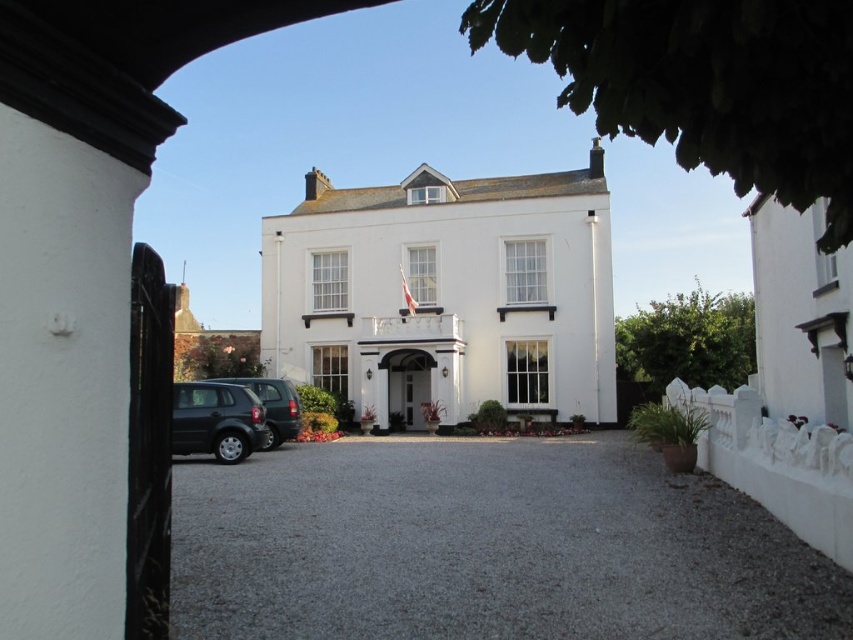
From the picture: Can you confirm if satin black car at lower left is positioned above matte dark green suv at lower left?

Actually, satin black car at lower left is below matte dark green suv at lower left.

Measure the distance between point (175,392) and camera.

Point (175,392) is 16.10 meters from camera.

At what (x,y) coordinates should I click in order to perform the action: click on satin black car at lower left. Please return your answer as a coordinate pair (x, y). Looking at the image, I should click on (216, 420).

How distant is gray gravel driveway at center from satin black car at lower left?

5.76 meters

Is gray gravel driveway at center shorter than satin black car at lower left?

Indeed, gray gravel driveway at center has a lesser height compared to satin black car at lower left.

Where is `gray gravel driveway at center`? The width and height of the screenshot is (853, 640). gray gravel driveway at center is located at coordinates (486, 547).

Is point (171, 611) farther from viewer compared to point (291, 385)?

That is False.

Which is below, gray gravel driveway at center or matte dark green suv at lower left?

gray gravel driveway at center is below.

Between point (613, 625) and point (221, 381), which one is positioned behind?

Point (221, 381)

Locate an element on the screen. The image size is (853, 640). gray gravel driveway at center is located at coordinates (486, 547).